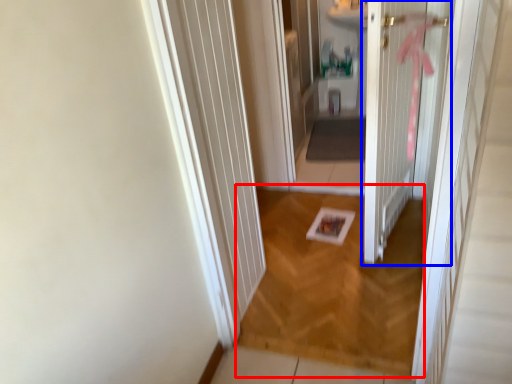
Question: Which point is closer to the camera, plain (highlighted by a red box) or door (highlighted by a blue box)?

Choices:
 (A) plain
 (B) door

Answer: (B)